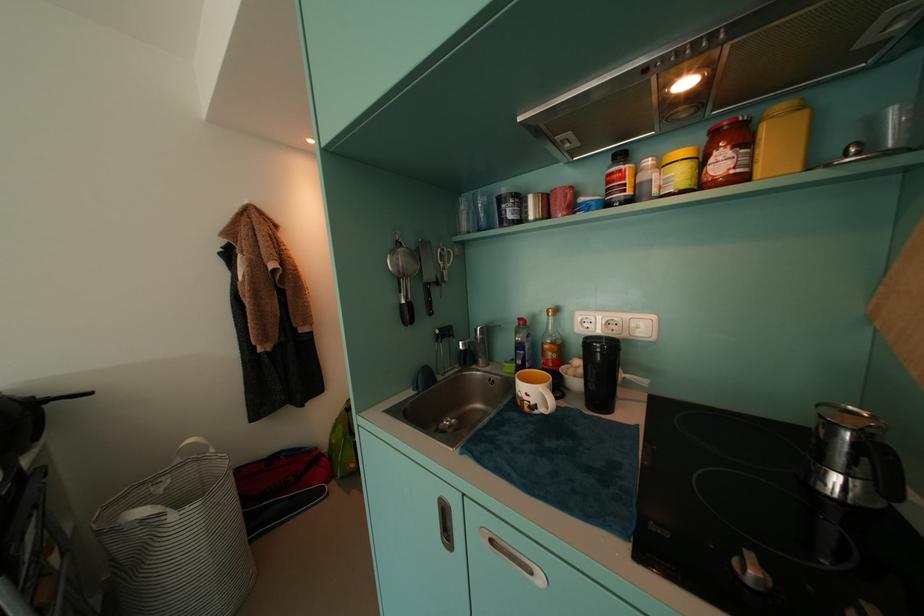
What do you see at coordinates (679, 155) in the screenshot? Image resolution: width=924 pixels, height=616 pixels. I see `the yellow container lid` at bounding box center [679, 155].